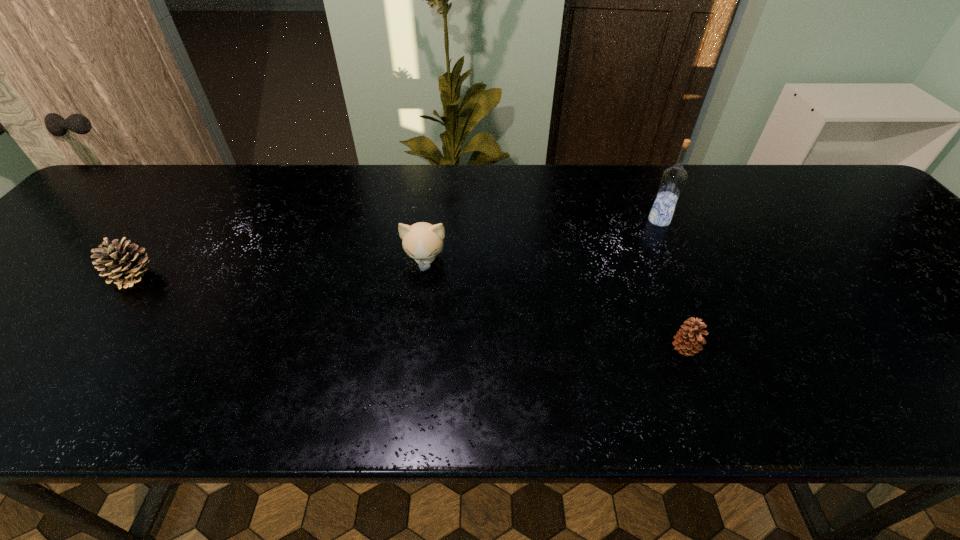
Where is `free space located on the back of the shorter pinecone`? The image size is (960, 540). free space located on the back of the shorter pinecone is located at coordinates (666, 301).

Identify the location of vacant space at the far edge of the desktop. The width and height of the screenshot is (960, 540). (494, 185).

What are the coordinates of `vacant space at the near edge of the desktop` in the screenshot? It's located at click(231, 405).

Where is `free location at the right edge`? The width and height of the screenshot is (960, 540). free location at the right edge is located at coordinates (894, 291).

In the image, there is a desktop. Identify the location of free space at the far left corner. Image resolution: width=960 pixels, height=540 pixels. (153, 192).

Where is `vacant space at the far right corner`? vacant space at the far right corner is located at coordinates (806, 187).

You are a GUI agent. You are given a task and a screenshot of the screen. Output one action in this format:
    pyautogui.click(x=<x>, y=<y>)
    Task: Click on the vacant point located between the kitten and the leftmost object
    This screenshot has height=540, width=960.
    Given the screenshot: What is the action you would take?
    pyautogui.click(x=279, y=269)

The height and width of the screenshot is (540, 960). Find the location of `unoccupied position between the shorter pinecone and the kitten`. unoccupied position between the shorter pinecone and the kitten is located at coordinates (555, 306).

What are the coordinates of `vacant space in between the farther pinecone and the shorter pinecone` in the screenshot? It's located at (410, 313).

This screenshot has height=540, width=960. I want to click on free spot between the farther pinecone and the shorter pinecone, so click(410, 313).